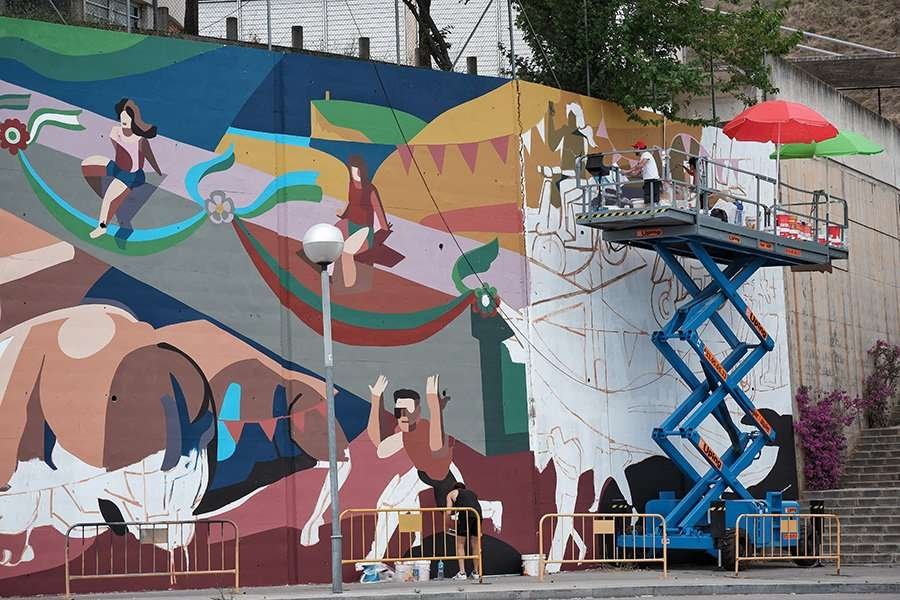
Where is `dark blue paint`? Image resolution: width=900 pixels, height=600 pixels. dark blue paint is located at coordinates (191, 440).